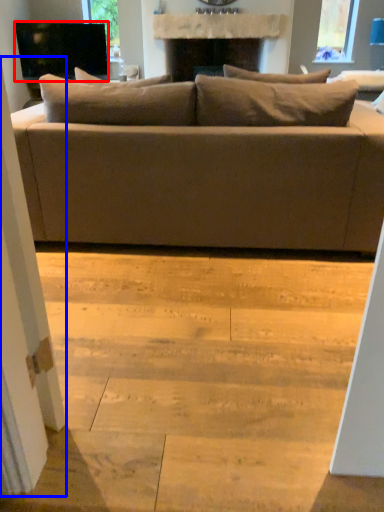
Question: Which point is further to the camera, television (highlighted by a red box) or screen door (highlighted by a blue box)?

Choices:
 (A) television
 (B) screen door

Answer: (A)